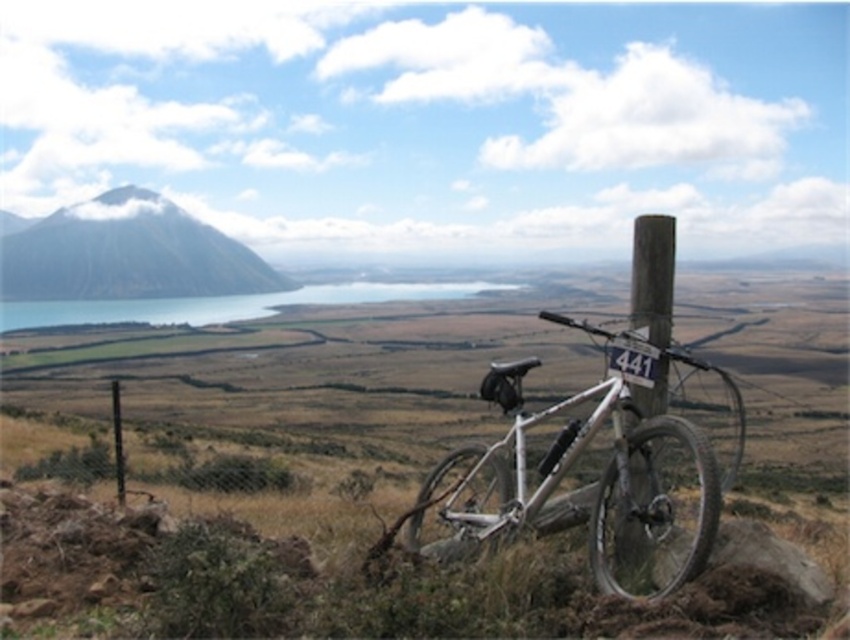
You are planning to take a photo of the blue glassy lake at center and the wooden post at right. Which object should you focus on first if you want to capture both in a single frame without moving the camera?

The blue glassy lake at center is larger in size than the wooden post at right, so you should focus on the blue glassy lake at center first to ensure it fills the frame appropriately before adjusting for the smaller wooden post at right.

You are a photographer planning to capture the silver metallic mountain bike at center and the green grassy hillside at left in a single wide shot. Based on their sizes, which object will appear larger in the final photograph?

The green grassy hillside at left will appear larger in the final photograph because the silver metallic mountain bike at center is smaller than it.